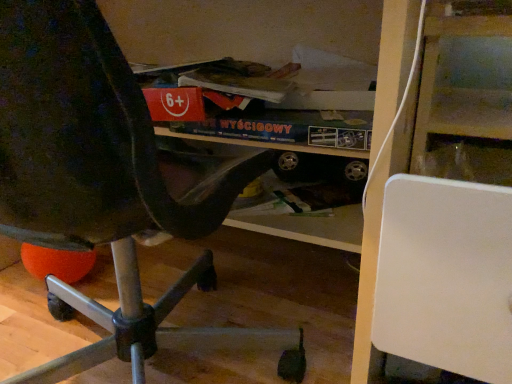
Question: Is matte black chair at left oriented towards white matte board at right?

Choices:
 (A) no
 (B) yes

Answer: (A)

Question: Is matte black chair at left not near white matte board at right?

Choices:
 (A) yes
 (B) no

Answer: (B)

Question: From the image's perspective, is matte black chair at left under white matte board at right?

Choices:
 (A) no
 (B) yes

Answer: (A)

Question: Is matte black chair at left thinner than white matte board at right?

Choices:
 (A) no
 (B) yes

Answer: (A)

Question: Is matte black chair at left to the right of white matte board at right from the viewer's perspective?

Choices:
 (A) yes
 (B) no

Answer: (B)

Question: Is the depth of matte black chair at left greater than that of white matte board at right?

Choices:
 (A) no
 (B) yes

Answer: (A)

Question: Is white matte board at right surrounding matte black chair at left?

Choices:
 (A) no
 (B) yes

Answer: (A)

Question: From the image's perspective, would you say white matte board at right is positioned over matte black chair at left?

Choices:
 (A) no
 (B) yes

Answer: (A)

Question: Considering the relative sizes of white matte board at right and matte black chair at left in the image provided, is white matte board at right smaller than matte black chair at left?

Choices:
 (A) no
 (B) yes

Answer: (B)

Question: Can you confirm if white matte board at right is thinner than matte black chair at left?

Choices:
 (A) yes
 (B) no

Answer: (A)

Question: Considering the relative sizes of white matte board at right and matte black chair at left in the image provided, is white matte board at right wider than matte black chair at left?

Choices:
 (A) yes
 (B) no

Answer: (B)

Question: Considering the relative positions of white matte board at right and matte black chair at left in the image provided, is white matte board at right behind matte black chair at left?

Choices:
 (A) yes
 (B) no

Answer: (A)

Question: Is point (45, 6) closer or farther from the camera than point (489, 120)?

Choices:
 (A) farther
 (B) closer

Answer: (B)